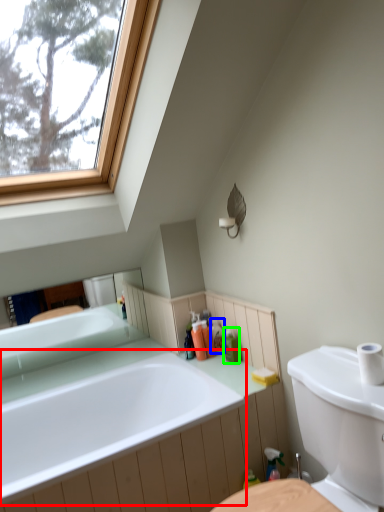
Question: Considering the real-world distances, which object is closest to bathtub (highlighted by a red box)? toiletry (highlighted by a blue box) or toiletry (highlighted by a green box).

Choices:
 (A) toiletry
 (B) toiletry

Answer: (B)